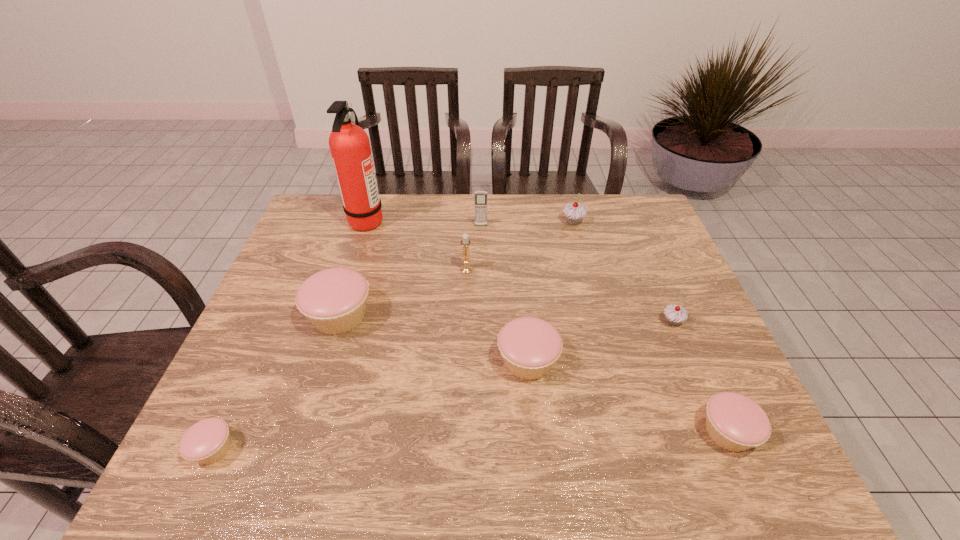
Where is `the tallest object`? This screenshot has width=960, height=540. the tallest object is located at coordinates [x=349, y=144].

You are a GUI agent. You are given a task and a screenshot of the screen. Output one action in this format:
    pyautogui.click(x=<x>, y=<y>)
    Task: Click on the red fire extinguisher
    The width and height of the screenshot is (960, 540).
    Given the screenshot: What is the action you would take?
    pyautogui.click(x=349, y=144)

You are a GUI agent. You are given a task and a screenshot of the screen. Output one action in this format:
    pyautogui.click(x=<x>, y=<y>)
    Task: Click on the fifth object from right to left
    
    Given the screenshot: What is the action you would take?
    pyautogui.click(x=480, y=196)

Locate an element on the screen. The height and width of the screenshot is (540, 960). cellular telephone is located at coordinates (480, 196).

You are a GUI agent. You are given a task and a screenshot of the screen. Output one action in this format:
    pyautogui.click(x=<x>, y=<y>)
    Task: Click on the sixth nearest object
    The height and width of the screenshot is (540, 960).
    Given the screenshot: What is the action you would take?
    pyautogui.click(x=465, y=242)

The height and width of the screenshot is (540, 960). What are the coordinates of `candle holder` in the screenshot? It's located at (465, 242).

Locate an element on the screen. Image resolution: width=960 pixels, height=540 pixels. the left gray cupcake is located at coordinates (574, 213).

Locate an element on the screen. The image size is (960, 540). the third cupcake from right to left is located at coordinates (574, 213).

Locate an element on the screen. Image resolution: width=960 pixels, height=540 pixels. the biggest pink cupcake is located at coordinates (334, 300).

You are a GUI agent. You are given a task and a screenshot of the screen. Output one action in this format:
    pyautogui.click(x=<x>, y=<y>)
    Task: Click on the second pink cupcake from left to right
    The image size is (960, 540).
    Given the screenshot: What is the action you would take?
    pyautogui.click(x=334, y=300)